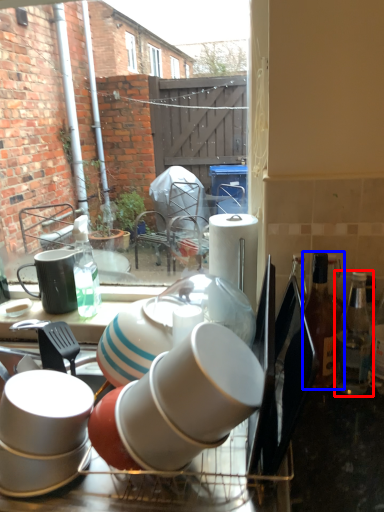
Question: Which object appears farthest to the camera in this image, bottle (highlighted by a red box) or bottle (highlighted by a blue box)?

Choices:
 (A) bottle
 (B) bottle

Answer: (B)